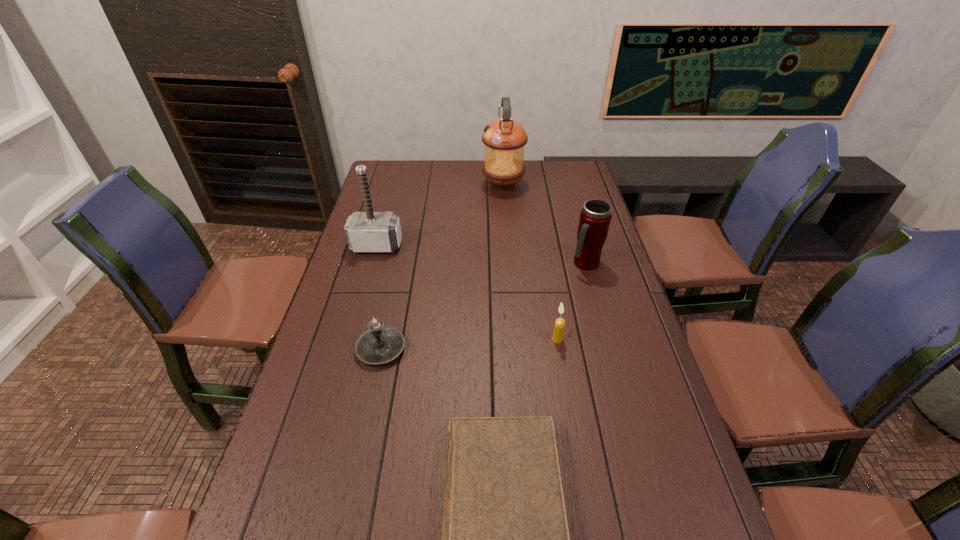
The image size is (960, 540). In order to click on vacant space that satisfies the following two spatial constraints: 1. for striking with the head of the fifth shortest object; 2. on the right side of the second object from right to left in this screenshot , I will do `click(350, 339)`.

Locate an element on the screen. vacant space that satisfies the following two spatial constraints: 1. for striking with the head of the hammer; 2. on the right side of the left candle is located at coordinates (348, 349).